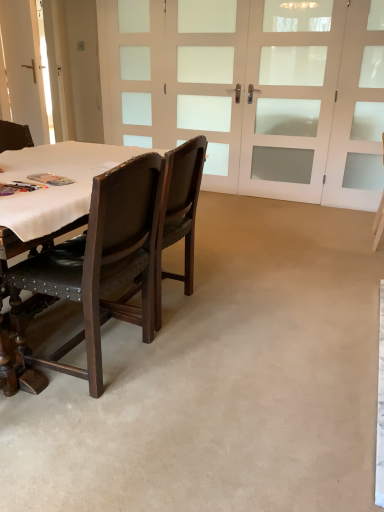
Where is `white fabric table at left`? The width and height of the screenshot is (384, 512). white fabric table at left is located at coordinates (55, 186).

Locate an element on the screen. white glass barn door at upper left is located at coordinates (24, 67).

You are a GUI agent. You are given a task and a screenshot of the screen. Output one action in this format:
    pyautogui.click(x=<x>, y=<y>)
    Task: Click on the white frosted glass screen door at upper right, acting as the 3th screen door starting from the left
    The image size is (384, 512).
    Given the screenshot: What is the action you would take?
    pyautogui.click(x=358, y=113)

What do you see at coordinates (178, 214) in the screenshot? I see `brown leather chair at center, the 2th chair viewed from the front` at bounding box center [178, 214].

Measure the distance between point (239,135) and camera.

The depth of point (239,135) is 4.23 meters.

Measure the distance between white glass doors at upper center, arranged as the second screen door when viewed from the right, and camera.

white glass doors at upper center, arranged as the second screen door when viewed from the right, is 11.51 feet away from camera.

The image size is (384, 512). In order to click on white glass doors at upper center, arranged as the 2th screen door when viewed from the left in this screenshot , I will do `click(290, 96)`.

Describe the element at coordinates (100, 264) in the screenshot. I see `leather at left, which ranks as the third chair in back-to-front order` at that location.

The width and height of the screenshot is (384, 512). What are the coordinates of `white fabric table at left` in the screenshot? It's located at (55, 186).

Is matte plastic book at table left aimed at white glass doors at center, which is the first screen door in left-to-right order?

No, matte plastic book at table left is not oriented towards white glass doors at center, which is the first screen door in left-to-right order.

Can you confirm if matte plastic book at table left is shorter than white glass doors at center, positioned as the 3th screen door in right-to-left order?

Yes.

Does matte plastic book at table left have a lesser width compared to white glass doors at center, positioned as the 3th screen door in right-to-left order?

No.

Is the depth of matte plastic book at table left greater than that of white glass doors at center, positioned as the 3th screen door in right-to-left order?

No, matte plastic book at table left is closer to the viewer.

Choose the correct answer: Is white glass doors at center, which is the first screen door in left-to-right order, inside leather at left, the 1th chair in the front-to-back sequence, or outside it?

white glass doors at center, which is the first screen door in left-to-right order, is not inside leather at left, the 1th chair in the front-to-back sequence, it's outside.

Considering the relative positions of white glass doors at center, which is the first screen door in left-to-right order, and leather at left, the 1th chair in the front-to-back sequence, in the image provided, is white glass doors at center, which is the first screen door in left-to-right order, behind leather at left, the 1th chair in the front-to-back sequence,?

Yes, it is behind leather at left, the 1th chair in the front-to-back sequence.

Are white glass doors at center, positioned as the 3th screen door in right-to-left order, and leather at left, the 1th chair in the front-to-back sequence, far apart?

white glass doors at center, positioned as the 3th screen door in right-to-left order, is far away from leather at left, the 1th chair in the front-to-back sequence.

Is white glass barn door at upper left next to white frosted glass screen door at upper right, acting as the 3th screen door starting from the left, and touching it?

white glass barn door at upper left and white frosted glass screen door at upper right, acting as the 3th screen door starting from the left, are not in contact.

Is white glass barn door at upper left not within white frosted glass screen door at upper right, marked as the 1th screen door in a right-to-left arrangement?

Absolutely, white glass barn door at upper left is external to white frosted glass screen door at upper right, marked as the 1th screen door in a right-to-left arrangement.

From the image's perspective, which one is positioned lower, white glass barn door at upper left or white frosted glass screen door at upper right, acting as the 3th screen door starting from the left?

white frosted glass screen door at upper right, acting as the 3th screen door starting from the left, is shown below in the image.

Is white glass barn door at upper left turned away from white frosted glass screen door at upper right, acting as the 3th screen door starting from the left?

No, white glass barn door at upper left's orientation is not away from white frosted glass screen door at upper right, acting as the 3th screen door starting from the left.

Which object is closer to the camera, white frosted glass screen door at upper right, marked as the 1th screen door in a right-to-left arrangement, or white fabric table at left?

white fabric table at left is in front.

From the image's perspective, is white frosted glass screen door at upper right, marked as the 1th screen door in a right-to-left arrangement, located beneath white fabric table at left?

Actually, white frosted glass screen door at upper right, marked as the 1th screen door in a right-to-left arrangement, appears above white fabric table at left in the image.

Can you confirm if white frosted glass screen door at upper right, marked as the 1th screen door in a right-to-left arrangement, is wider than white fabric table at left?

No.

Which screen door is the 1st one when counting from the back of the white fabric table at left? Please provide its 2D coordinates.

[(358, 113)]

From a real-world perspective, is white frosted glass screen door at upper right, acting as the 3th screen door starting from the left, physically located above or below leather at left, the 1th chair in the front-to-back sequence?

white frosted glass screen door at upper right, acting as the 3th screen door starting from the left, is above leather at left, the 1th chair in the front-to-back sequence.

Which of these two, white frosted glass screen door at upper right, acting as the 3th screen door starting from the left, or leather at left, which is counted as the 3th chair, starting from the right, stands taller?

With more height is white frosted glass screen door at upper right, acting as the 3th screen door starting from the left.

Is leather at left, which is counted as the 3th chair, starting from the right, surrounded by white frosted glass screen door at upper right, marked as the 1th screen door in a right-to-left arrangement?

No, leather at left, which is counted as the 3th chair, starting from the right, is not inside white frosted glass screen door at upper right, marked as the 1th screen door in a right-to-left arrangement.

Which is correct: white frosted glass screen door at upper right, marked as the 1th screen door in a right-to-left arrangement, is inside white glass barn door at upper left, or outside of it?

white frosted glass screen door at upper right, marked as the 1th screen door in a right-to-left arrangement, is outside white glass barn door at upper left.

The image size is (384, 512). Identify the location of barn door located above the white frosted glass screen door at upper right, marked as the 1th screen door in a right-to-left arrangement (from a real-world perspective). [x=24, y=67].

Is white frosted glass screen door at upper right, marked as the 1th screen door in a right-to-left arrangement, facing away from white glass barn door at upper left?

That's not correct — white frosted glass screen door at upper right, marked as the 1th screen door in a right-to-left arrangement, is not looking away from white glass barn door at upper left.

Is leather at left, which is counted as the 3th chair, starting from the right, bigger than white fabric table at left?

Indeed, leather at left, which is counted as the 3th chair, starting from the right, has a larger size compared to white fabric table at left.

Does leather at left, which is counted as the 3th chair, starting from the right, have a greater height compared to white fabric table at left?

Yes.

How different are the orientations of leather at left, the 1th chair in the front-to-back sequence, and white fabric table at left in degrees?

They differ by 88.5 degrees in their facing directions.

From the matte plastic book at table left, count 1st screen door to the right and point to it. Please provide its 2D coordinates.

[(208, 80)]

This screenshot has width=384, height=512. I want to click on the 2nd chair counting from the left side of the white glass doors at center, which is the first screen door in left-to-right order, so click(100, 264).

Which object lies nearer to the anchor point white frosted glass screen door at upper right, marked as the 1th screen door in a right-to-left arrangement, white glass doors at upper center, arranged as the 2th screen door when viewed from the left, or white glass barn door at upper left?

The object closer to white frosted glass screen door at upper right, marked as the 1th screen door in a right-to-left arrangement, is white glass doors at upper center, arranged as the 2th screen door when viewed from the left.

Which object lies further to the anchor point white frosted glass screen door at upper right, marked as the 1th screen door in a right-to-left arrangement, white glass barn door at upper left or brown leather chair at center, which is the 2th chair from right to left?

white glass barn door at upper left is positioned further to the anchor white frosted glass screen door at upper right, marked as the 1th screen door in a right-to-left arrangement.

Which object lies further to the anchor point white fabric table at left, matte plastic book at table left or white glass barn door at upper left?

Based on the image, white glass barn door at upper left appears to be further to white fabric table at left.

Looking at the image, which one is located further to white glass barn door at upper left, white glass doors at upper center, arranged as the second screen door when viewed from the right, or white frosted glass screen door at upper right, acting as the 3th screen door starting from the left?

white frosted glass screen door at upper right, acting as the 3th screen door starting from the left, lies further to white glass barn door at upper left than the other object.

Considering their positions, is leather at left, which is counted as the 3th chair, starting from the right, positioned closer to brown leather chair at center, which is the 2th chair from right to left, than white glass barn door at upper left?

leather at left, which is counted as the 3th chair, starting from the right.

Considering their positions, is white frosted glass screen door at upper right, marked as the 1th screen door in a right-to-left arrangement, positioned closer to white glass doors at upper center, arranged as the 2th screen door when viewed from the left, than leather at left, placed as the first chair when sorted from left to right?

Among the two, white frosted glass screen door at upper right, marked as the 1th screen door in a right-to-left arrangement, is located nearer to white glass doors at upper center, arranged as the 2th screen door when viewed from the left.

Looking at this image, estimate the real-world distances between objects in this image. Which object is further from white fabric table at left, white frosted glass screen door at upper right, marked as the 1th screen door in a right-to-left arrangement, or leather at left, which is counted as the 3th chair, starting from the right?

white frosted glass screen door at upper right, marked as the 1th screen door in a right-to-left arrangement, is further to white fabric table at left.

From the image, which object appears to be farther from leather at left, placed as the first chair when sorted from left to right, white fabric table at left or matte plastic book at table left?

Among the two, matte plastic book at table left is located further to leather at left, placed as the first chair when sorted from left to right.

Find the location of `book between white fabric table at left and white glass barn door at upper left along the z-axis`. book between white fabric table at left and white glass barn door at upper left along the z-axis is located at coordinates point(50,179).

The image size is (384, 512). I want to click on screen door located between white glass barn door at upper left and white glass doors at upper center, arranged as the second screen door when viewed from the right, in the left-right direction, so click(x=208, y=80).

Where is `chair between white fabric table at left and brown leather chair at center, which is the 2th chair from back to front, in the front-back direction`? chair between white fabric table at left and brown leather chair at center, which is the 2th chair from back to front, in the front-back direction is located at coordinates (100, 264).

This screenshot has width=384, height=512. Identify the location of book situated between white glass barn door at upper left and white glass doors at upper center, arranged as the 2th screen door when viewed from the left, from left to right. click(x=50, y=179).